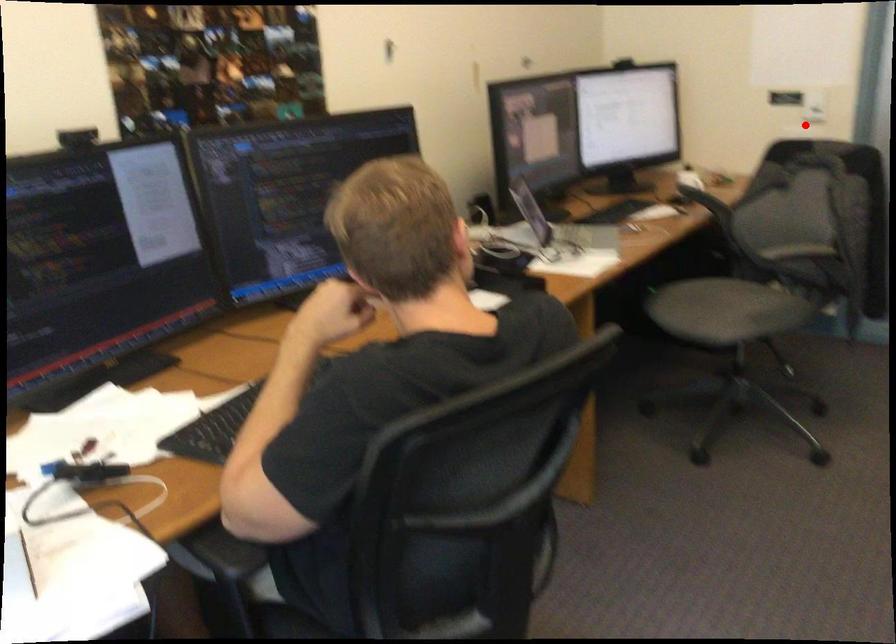
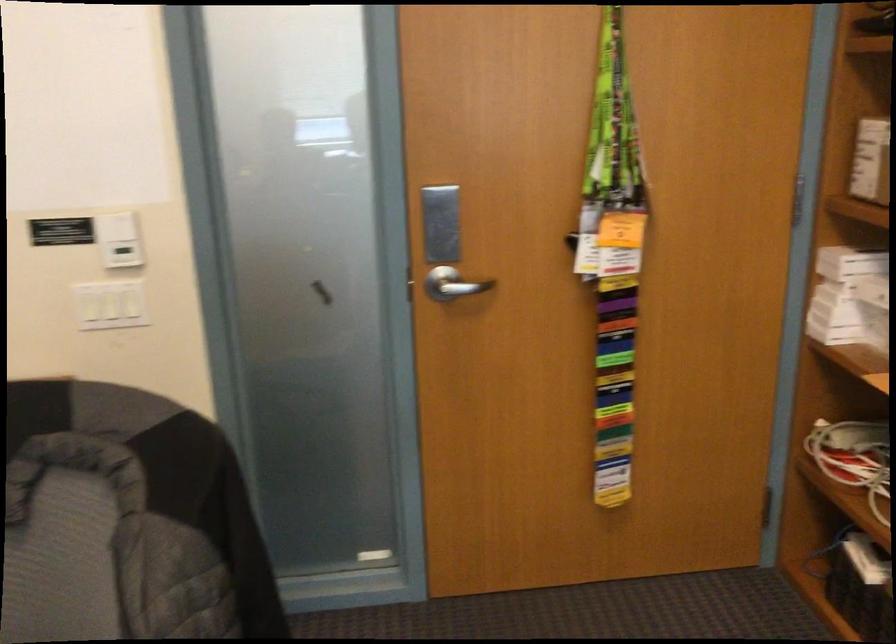
Question: I am providing you with two images of the same scene from different viewpoints. Given a red point in image1, look at the same physical point in image2. Is it:

Choices:
 (A) Closer to the viewpoint
 (B) Farther from the viewpoint

Answer: (A)